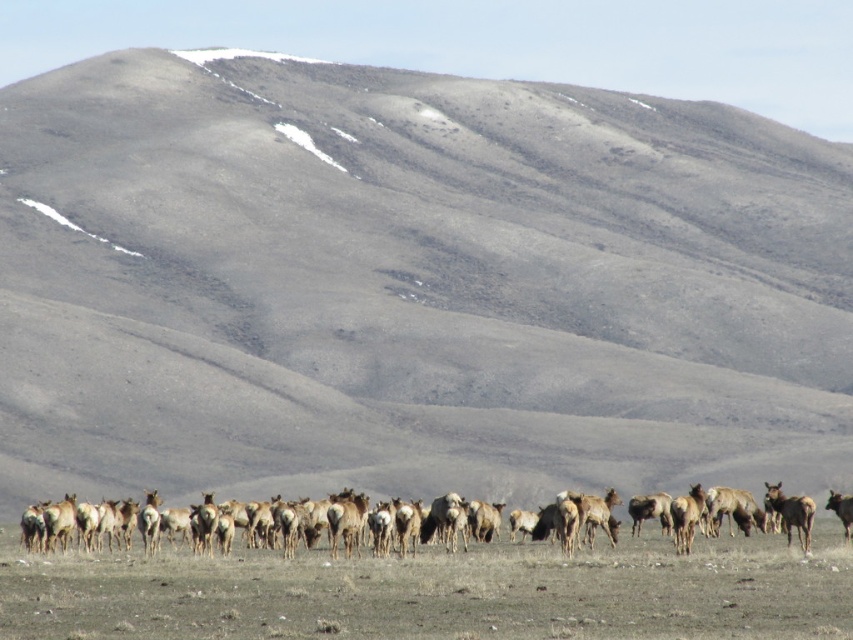
Question: Which point is closer to the camera?

Choices:
 (A) (647, 596)
 (B) (221, 528)
 (C) (846, 534)

Answer: (A)

Question: Is brown textured grassland at center wider than brown furry elk at center?

Choices:
 (A) yes
 (B) no

Answer: (A)

Question: Can you confirm if brown textured grassland at center is thinner than brown furry elk at center?

Choices:
 (A) yes
 (B) no

Answer: (B)

Question: Is brown textured grassland at center thinner than brown furry elk at center?

Choices:
 (A) no
 (B) yes

Answer: (A)

Question: Which object is closer to the camera taking this photo?

Choices:
 (A) brown furry elk at center
 (B) brown textured grassland at center
 (C) brown fur herd at lower center

Answer: (B)

Question: Which is nearer to the brown fur herd at lower center?

Choices:
 (A) brown furry elk at center
 (B) brown textured grassland at center

Answer: (B)